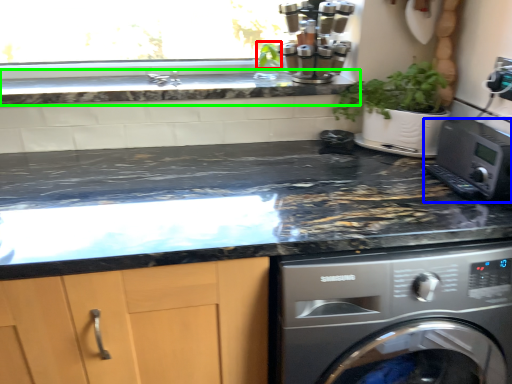
Question: Estimate the real-world distances between objects in this image. Which object is farther from plant (highlighted by a red box), home appliance (highlighted by a blue box) or countertop (highlighted by a green box)?

Choices:
 (A) home appliance
 (B) countertop

Answer: (A)